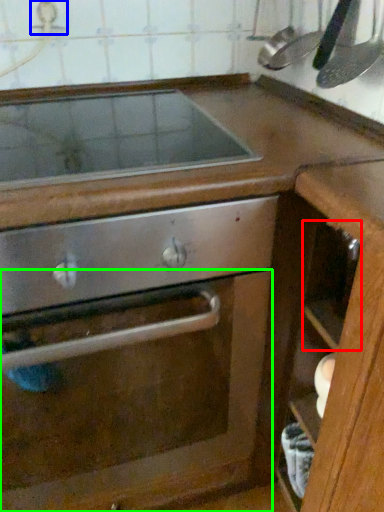
Question: Which object is the closest to the drawer (highlighted by a red box)? Choose among these: faucet (highlighted by a blue box) or glass door (highlighted by a green box).

Choices:
 (A) faucet
 (B) glass door

Answer: (B)